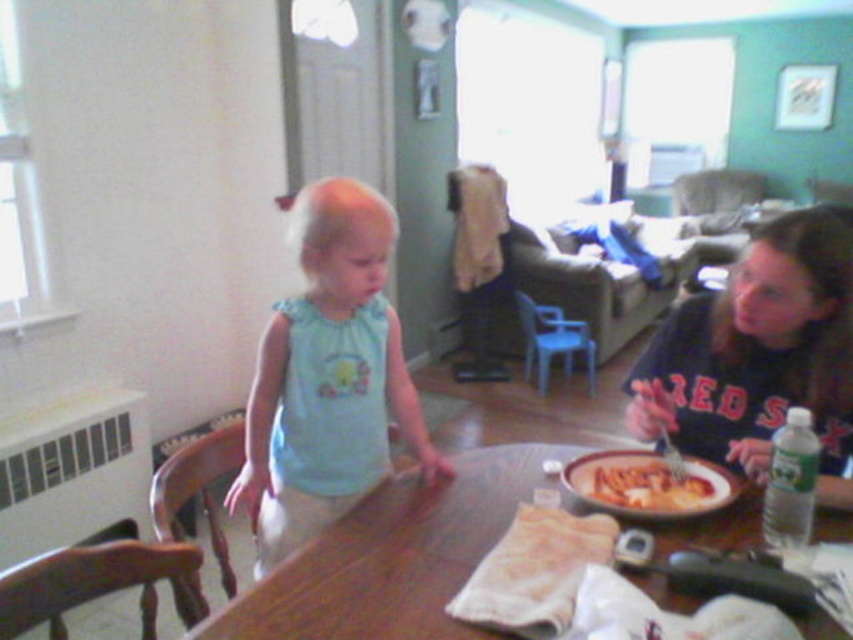
You are standing in the room and want to place a small vase on the light blue fabric at center. Where should you place the vase in terms of coordinates?

The light blue fabric at center is located at coordinates point (328, 378), so you should place the vase there.

You are setting up a centerpiece for a dinner party and need to place both the light blue fabric at center and the matte plastic bowl at table center on the table. Which object should you place first to ensure proper positioning?

You should place the matte plastic bowl at table center first because the light blue fabric at center is taller than it, so placing the bowl first allows the fabric to be positioned over or around it without obstruction.